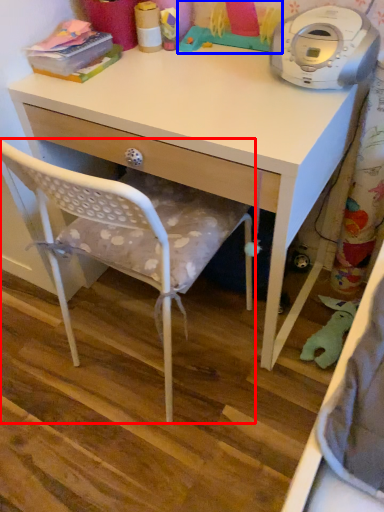
Question: Among these objects, which one is nearest to the camera, chair (highlighted by a red box) or toy (highlighted by a blue box)?

Choices:
 (A) chair
 (B) toy

Answer: (A)